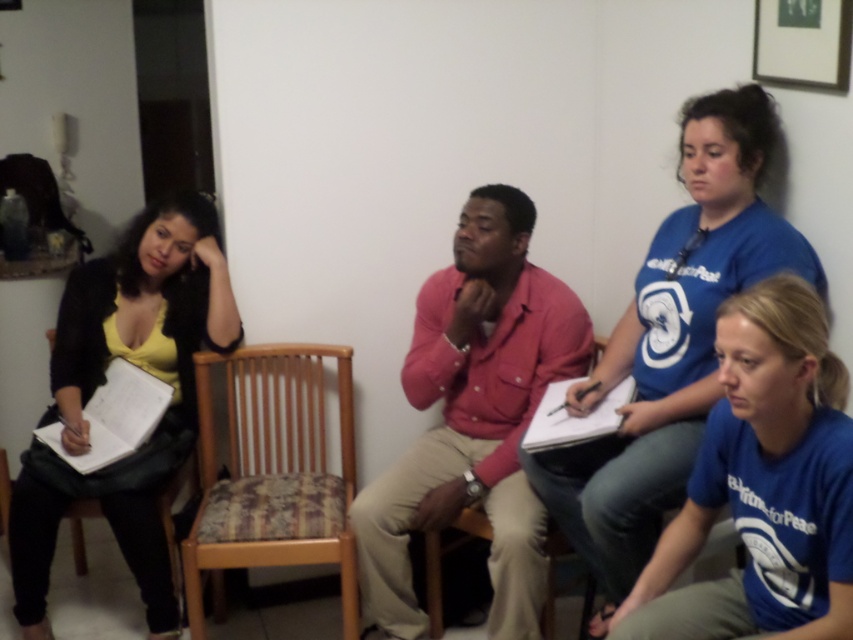
Which of these two, matte yellow shirt at left or wooden chair at center, stands taller?

Standing taller between the two is matte yellow shirt at left.

Does matte yellow shirt at left appear under wooden chair at center?

No.

Between point (67, 476) and point (424, 556), which one is positioned behind?

The point (424, 556) is behind.

At what (x,y) coordinates should I click in order to perform the action: click on matte yellow shirt at left. Please return your answer as a coordinate pair (x, y). This screenshot has width=853, height=640. Looking at the image, I should click on (102, 381).

Does blue cotton shirt at upper right have a lesser height compared to woodenwoodenchair at center?

No, blue cotton shirt at upper right is not shorter than woodenwoodenchair at center.

Who is more forward, (672,365) or (337,522)?

Point (672,365)

Locate an element on the screen. blue cotton shirt at upper right is located at coordinates (672, 340).

Is pink cotton shirt at center closer to the viewer compared to wooden chair at center?

Yes, pink cotton shirt at center is in front of wooden chair at center.

I want to click on pink cotton shirt at center, so click(x=473, y=419).